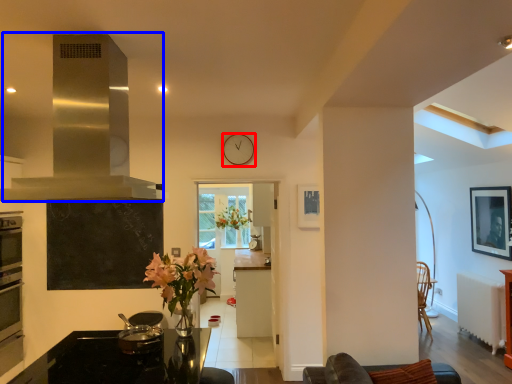
Question: Which object is further to the camera taking this photo, clock (highlighted by a red box) or exhaust hood (highlighted by a blue box)?

Choices:
 (A) clock
 (B) exhaust hood

Answer: (A)